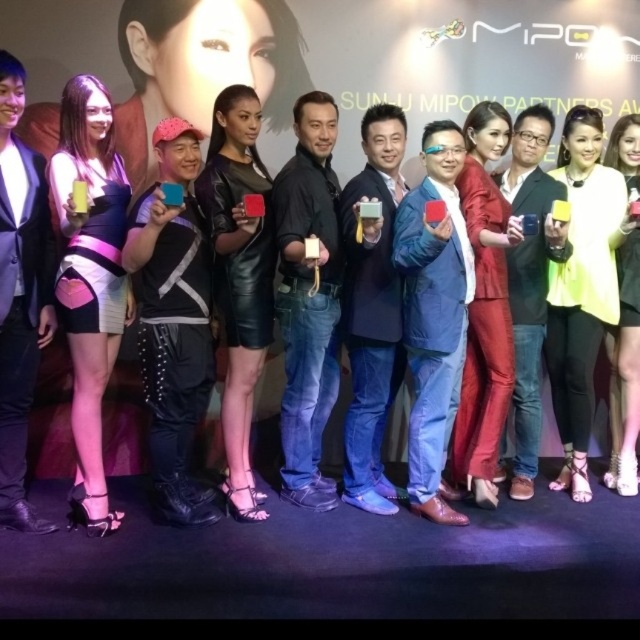
Is point (412, 490) in front of point (547, 132)?

Yes, point (412, 490) is in front of point (547, 132).

Is matte blue suit at center positioned in front of matte black phone at center?

That is True.

The height and width of the screenshot is (640, 640). What do you see at coordinates (433, 312) in the screenshot?
I see `matte blue suit at center` at bounding box center [433, 312].

You are a GUI agent. You are given a task and a screenshot of the screen. Output one action in this format:
    pyautogui.click(x=<x>, y=<y>)
    Task: Click on the matte blue suit at center
    The width and height of the screenshot is (640, 640).
    Given the screenshot: What is the action you would take?
    pyautogui.click(x=433, y=312)

Does matte black suit at center have a greater width compared to pink satin dress at center?

Indeed, matte black suit at center has a greater width compared to pink satin dress at center.

Is point (390, 500) closer to viewer compared to point (10, 285)?

No, (390, 500) is behind (10, 285).

Which is in front, point (372, 193) or point (16, 477)?

Positioned in front is point (16, 477).

Locate an element on the screen. The width and height of the screenshot is (640, 640). matte black suit at center is located at coordinates (372, 314).

Measure the distance between shiny red leather pants at center and camera.

shiny red leather pants at center and camera are 2.58 meters apart from each other.

Which is in front, point (497, 147) or point (541, 262)?

Point (497, 147)

What do you see at coordinates (484, 307) in the screenshot?
I see `shiny red leather pants at center` at bounding box center [484, 307].

I want to click on shiny red leather pants at center, so click(x=484, y=307).